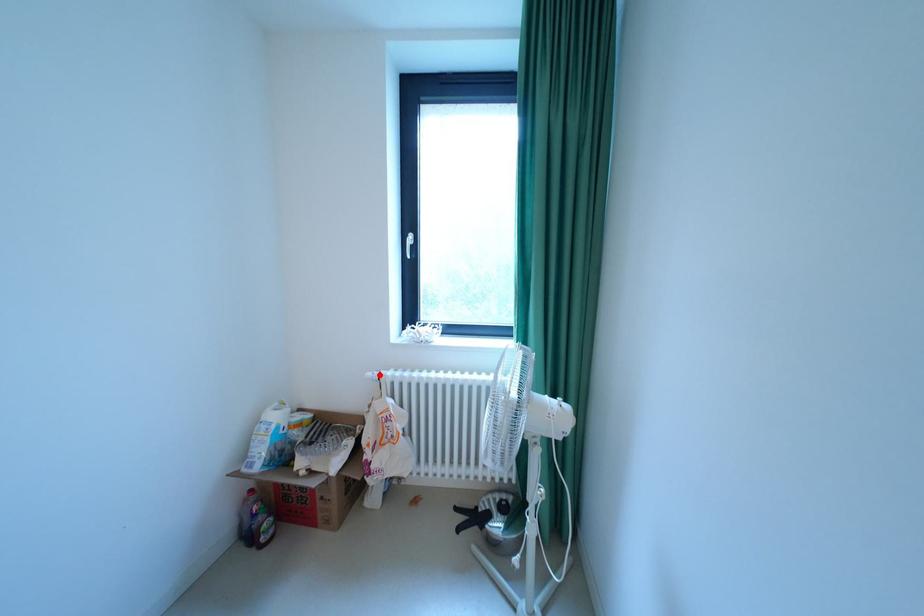
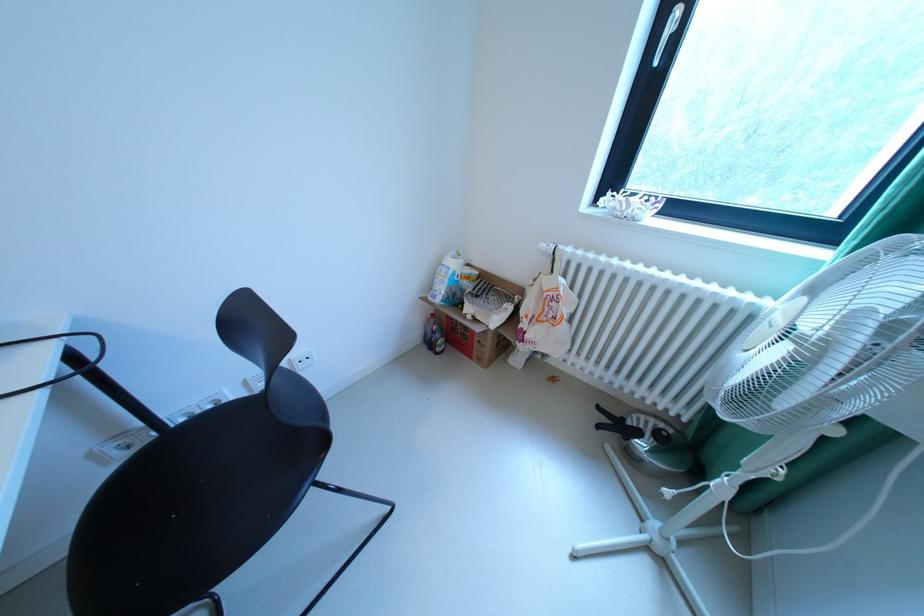
Locate, in the second image, the point that corresponds to the highlighted location in the first image.

(553, 246)